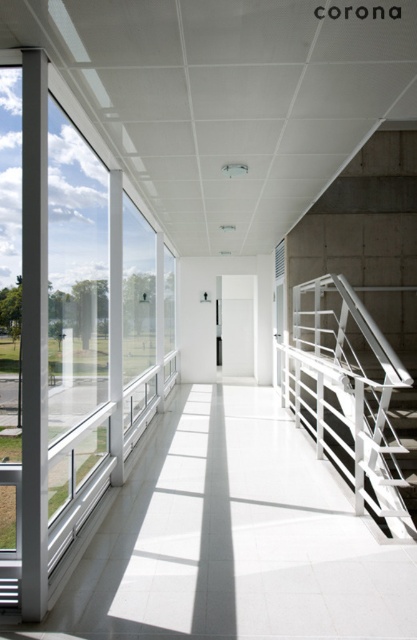
Is transparent glass window at left shorter than white metal railing at right?

No, transparent glass window at left is not shorter than white metal railing at right.

Is point (22, 65) positioned after point (391, 467)?

No, (22, 65) is in front of (391, 467).

At what (x,y) coordinates should I click in order to perform the action: click on transparent glass window at left. Please return your answer as a coordinate pair (x, y). This screenshot has height=640, width=417. Looking at the image, I should click on [67, 332].